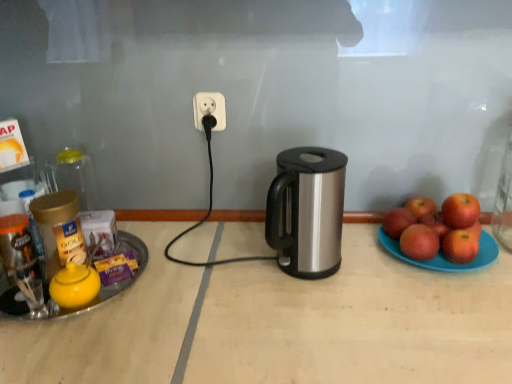
Identify the location of free space above silver metallic kettle at center (from a real-world perspective). (365, 290).